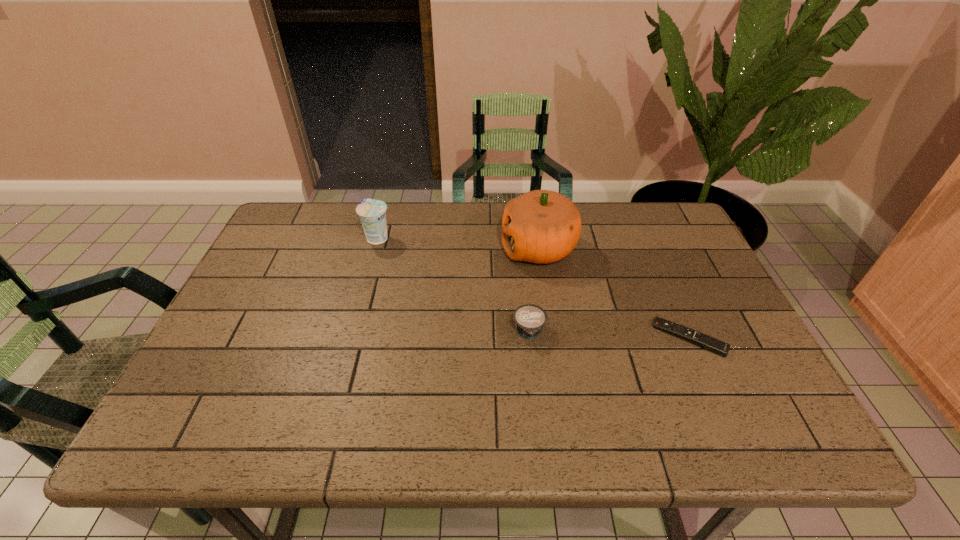
In order to click on free space between the tallest object and the shortest object in this screenshot , I will do `click(613, 293)`.

You are a GUI agent. You are given a task and a screenshot of the screen. Output one action in this format:
    pyautogui.click(x=<x>, y=<y>)
    Task: Click on the free space that is in between the tallest object and the third tallest object
    
    Given the screenshot: What is the action you would take?
    pyautogui.click(x=534, y=290)

Locate an element on the screen. Image resolution: width=960 pixels, height=540 pixels. blank region between the second tallest object and the tallest object is located at coordinates (458, 243).

Identify which object is the third closest to the taller yogurt. Please provide its 2D coordinates. Your answer should be formatted as a tuple, i.e. [(x, y)], where the tuple contains the x and y coordinates of a point satisfying the conditions above.

[(707, 342)]

Find the location of `the second closest object to the nearer yogurt`. the second closest object to the nearer yogurt is located at coordinates click(707, 342).

Where is `vacant space that satisfies the following two spatial constraints: 1. on the face of the pumpkin; 2. on the right side of the remote control`? The image size is (960, 540). vacant space that satisfies the following two spatial constraints: 1. on the face of the pumpkin; 2. on the right side of the remote control is located at coordinates (552, 338).

Where is `vacant area in the image that satisfies the following two spatial constraints: 1. on the front side of the taller yogurt; 2. on the right side of the third tallest object`? Image resolution: width=960 pixels, height=540 pixels. vacant area in the image that satisfies the following two spatial constraints: 1. on the front side of the taller yogurt; 2. on the right side of the third tallest object is located at coordinates (351, 332).

At what (x,y) coordinates should I click in order to perform the action: click on vacant space that satisfies the following two spatial constraints: 1. on the face of the pumpkin; 2. on the front side of the right yogurt. Please return your answer as a coordinate pair (x, y). This screenshot has height=540, width=960. Looking at the image, I should click on (551, 332).

Find the location of a particular element. The image size is (960, 540). vacant space that satisfies the following two spatial constraints: 1. on the face of the tallest object; 2. on the back side of the shortest object is located at coordinates (552, 338).

At what (x,y) coordinates should I click in order to perform the action: click on vacant space that satisfies the following two spatial constraints: 1. on the face of the pumpkin; 2. on the right side of the rightmost object. Please return your answer as a coordinate pair (x, y). The height and width of the screenshot is (540, 960). Looking at the image, I should click on (552, 338).